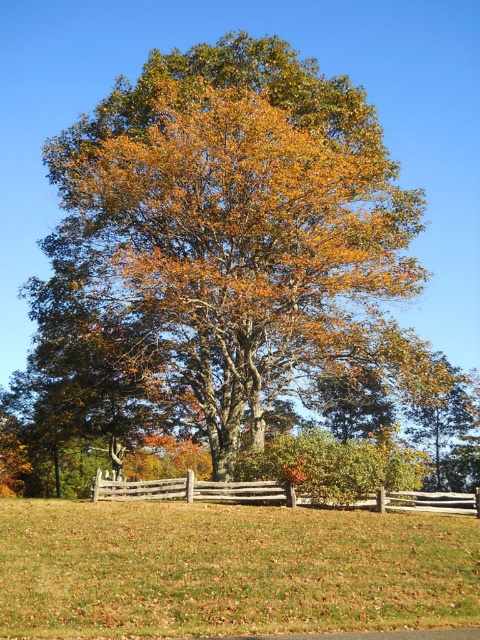
Is golden-brown bark oak at center closer to camera compared to brown wooden fence at lower center?

No, it is behind brown wooden fence at lower center.

Does golden-brown bark oak at center appear on the left side of brown wooden fence at lower center?

Indeed, golden-brown bark oak at center is positioned on the left side of brown wooden fence at lower center.

You are a GUI agent. You are given a task and a screenshot of the screen. Output one action in this format:
    pyautogui.click(x=<x>, y=<y>)
    Task: Click on the golden-brown bark oak at center
    The height and width of the screenshot is (640, 480).
    Given the screenshot: What is the action you would take?
    pyautogui.click(x=232, y=237)

Image resolution: width=480 pixels, height=640 pixels. I want to click on golden-brown bark oak at center, so click(232, 237).

Does green grass at lower center come in front of brown wooden fence at lower center?

Yes.

Can you confirm if green grass at lower center is positioned above brown wooden fence at lower center?

Correct, green grass at lower center is located above brown wooden fence at lower center.

This screenshot has height=640, width=480. What are the coordinates of `green grass at lower center` in the screenshot? It's located at point(228,570).

Consider the image. Does golden-brown bark oak at center come in front of green grass at lower center?

That is False.

How much distance is there between golden-brown bark oak at center and green grass at lower center?

The distance of golden-brown bark oak at center from green grass at lower center is 37.25 feet.

Who is more forward, (146, 140) or (11, 560)?

Point (11, 560) is more forward.

This screenshot has width=480, height=640. Find the location of `golden-brown bark oak at center`. golden-brown bark oak at center is located at coordinates (232, 237).